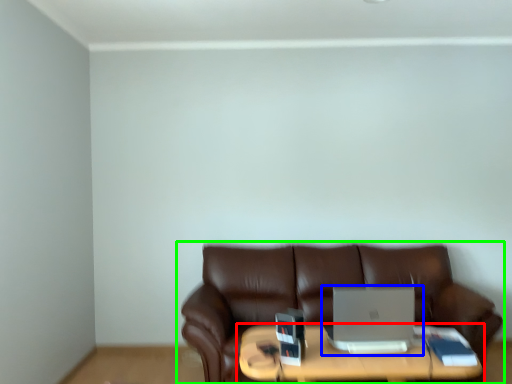
Question: Estimate the real-world distances between objects in this image. Which object is closer to table (highlighted by a red box), laptop (highlighted by a blue box) or studio couch (highlighted by a green box)?

Choices:
 (A) laptop
 (B) studio couch

Answer: (A)